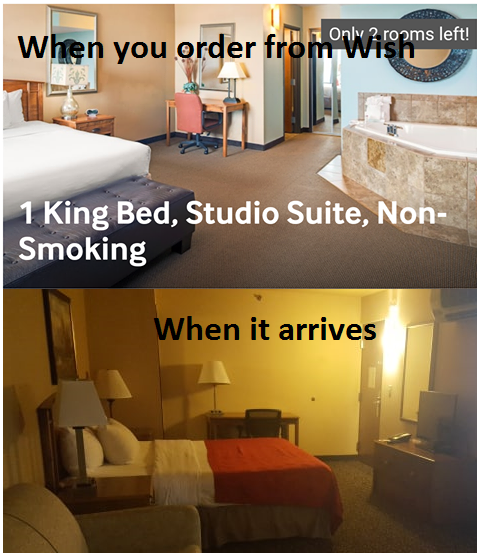
The image size is (477, 553). What are the coordinates of `floor` in the screenshot? It's located at (357, 523).